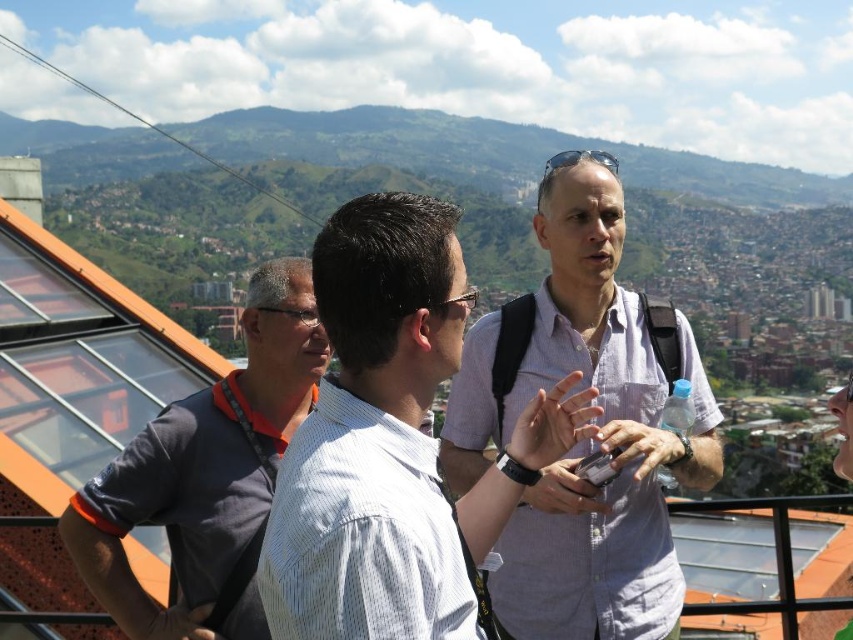
Question: Which object is farther from the camera taking this photo?

Choices:
 (A) light purple shirt at center
 (B) white striped shirt at center

Answer: (A)

Question: Can you confirm if white striped shirt at center is wider than light purple shirt at center?

Choices:
 (A) no
 (B) yes

Answer: (B)

Question: Which of the following is the farthest from the observer?

Choices:
 (A) white striped shirt at center
 (B) light purple shirt at center
 (C) gray fabric shirt at left

Answer: (B)

Question: Among these objects, which one is farthest from the camera?

Choices:
 (A) white striped shirt at center
 (B) light purple shirt at center
 (C) gray fabric shirt at left

Answer: (B)

Question: Is white striped shirt at center positioned at the back of gray fabric shirt at left?

Choices:
 (A) no
 (B) yes

Answer: (A)

Question: Is white striped shirt at center to the right of gray fabric shirt at left from the viewer's perspective?

Choices:
 (A) no
 (B) yes

Answer: (B)